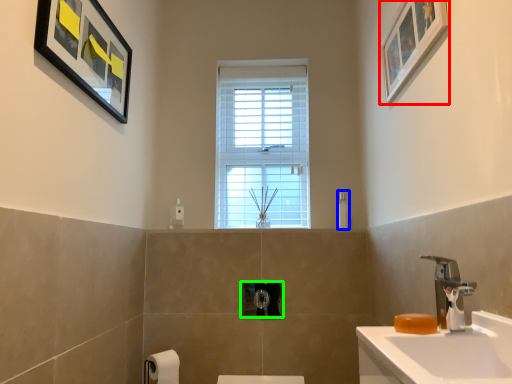
Question: Which object is the closest to the picture frame (highlighted by a red box)? Choose among these: soap dispenser (highlighted by a blue box) or towel bar (highlighted by a green box).

Choices:
 (A) soap dispenser
 (B) towel bar

Answer: (A)